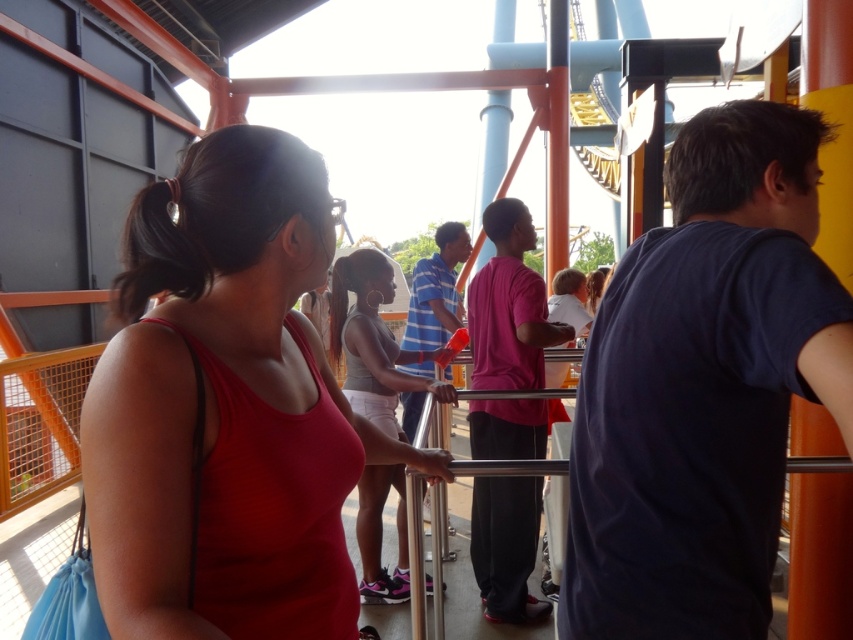
Can you confirm if matte red tank top at center is smaller than gray fabric tank top at center?

Correct, matte red tank top at center occupies less space than gray fabric tank top at center.

What do you see at coordinates (227, 406) in the screenshot? The width and height of the screenshot is (853, 640). I see `matte red tank top at center` at bounding box center [227, 406].

Is point (285, 161) closer to viewer compared to point (341, 276)?

Yes, point (285, 161) is closer to viewer.

Where is `matte red tank top at center`? Image resolution: width=853 pixels, height=640 pixels. matte red tank top at center is located at coordinates (227, 406).